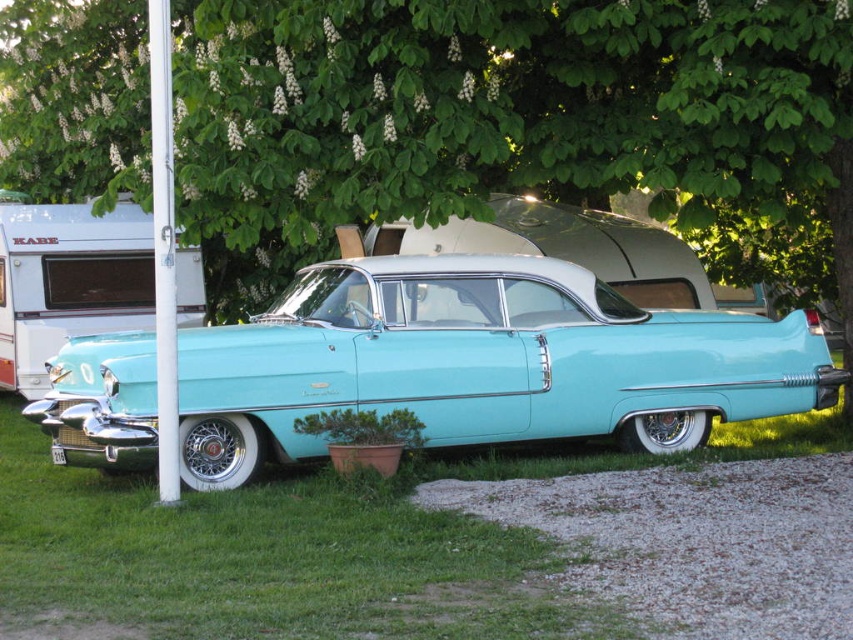
Question: Among these objects, which one is farthest from the camera?

Choices:
 (A) light blue glossy car at center
 (B) green leafy tree at upper center
 (C) metallic silver trailer at left

Answer: (C)

Question: Can you confirm if green leafy tree at upper center is wider than metallic silver trailer at left?

Choices:
 (A) no
 (B) yes

Answer: (B)

Question: Which point appears farthest from the camera in this image?

Choices:
 (A) (132, 342)
 (B) (637, 97)

Answer: (B)

Question: Which object is farther from the camera taking this photo?

Choices:
 (A) green leafy tree at upper center
 (B) light blue glossy car at center

Answer: (A)

Question: Is green leafy tree at upper center bigger than light blue glossy car at center?

Choices:
 (A) no
 (B) yes

Answer: (B)

Question: Is green leafy tree at upper center closer to the viewer compared to metallic silver trailer at left?

Choices:
 (A) yes
 (B) no

Answer: (A)